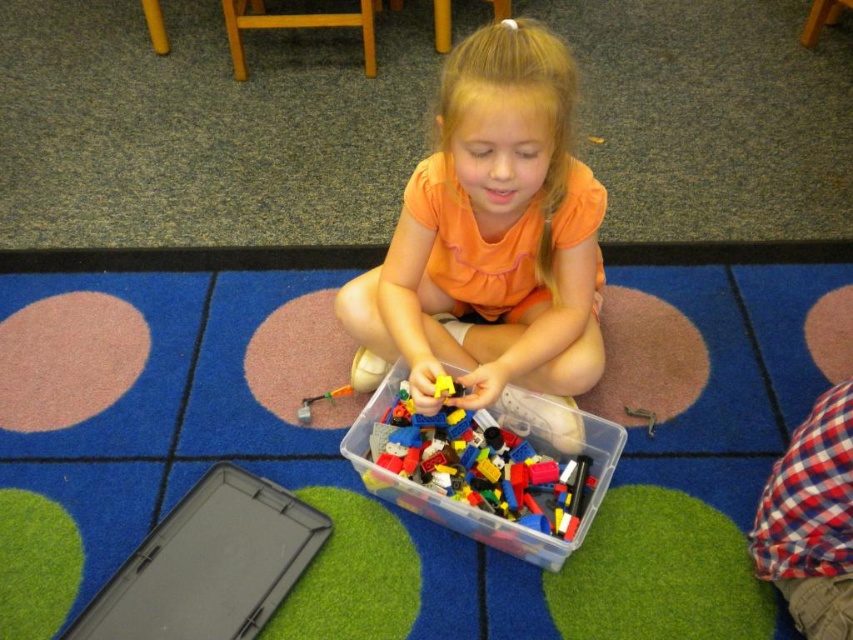
You need to place a rectangular toy box that is 2 feet wide on the floor. The blue carpet at center and the translucent plastic container at center are in the way. Which object should you move to make space?

The blue carpet at center might be wider than the translucent plastic container at center, so you should move the translucent plastic container at center to make space for the toy box since it is narrower.

You are a parent trying to organize toys. You have a red plaid shirt at lower right and a translucent plastic container at center. Which item is narrower?

The red plaid shirt at lower right is narrower than the translucent plastic container at center.

You are a photographer trying to capture the exact position of the orange matte shirt at center in the image. According to the coordinates provided, where would you focus your camera lens to ensure the shirt is centered in the frame?

To center the orange matte shirt at center in the frame, focus the camera lens at the coordinates point specified in the description, which is point (492,234).